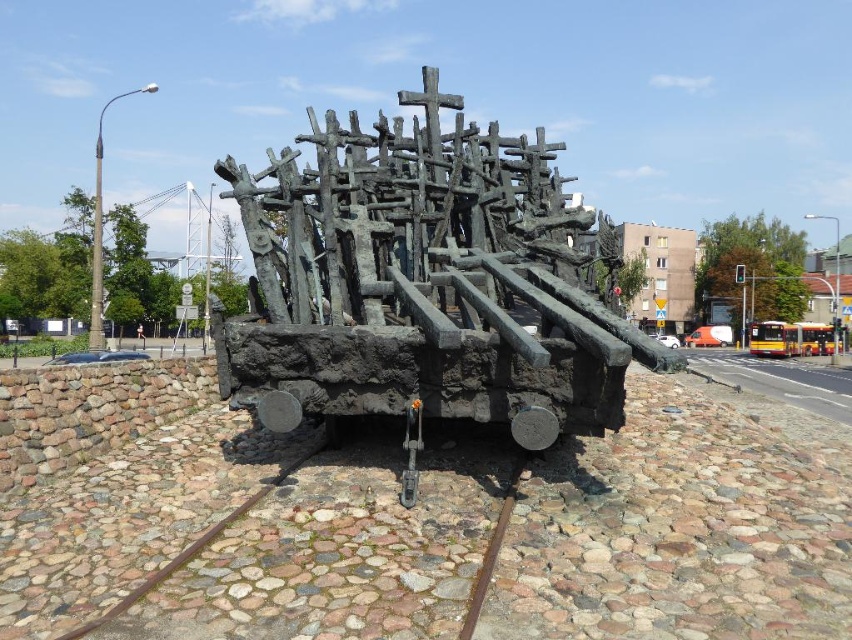
You are a city planner assessing the placement of the bronze sculpture at center and the rusty metal train track at center. Based on the scene, which object is directly above the other?

The bronze sculpture at center is positioned over the rusty metal train track at center, so the bronze sculpture is directly above the train track.

You are a maintenance worker tasked with moving the bronze sculpture at center. You need to check if the brown rusty metal train track at lower center is in the way. Based on the scene, is the train track behind or in front of the sculpture?

The brown rusty metal train track at lower center is behind the bronze sculpture at center, so it is not in the way.

You are a maintenance worker needing to place a 10 feet long safety barrier between the bronze sculpture at center and the rusty metal train track at center. Can you fit it between them?

The bronze sculpture at center is 9.08 feet from the rusty metal train track at center. Since the safety barrier is 10 feet long, it cannot be placed between them as the distance is shorter than the barrier.